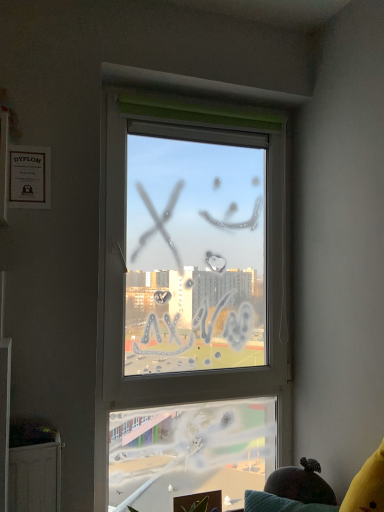
Question: Visually, is velvet yellow couch at lower right positioned to the left or to the right of transparent glass window at center?

Choices:
 (A) left
 (B) right

Answer: (B)

Question: Considering the positions of velvet yellow couch at lower right and transparent glass window at center in the image, is velvet yellow couch at lower right taller or shorter than transparent glass window at center?

Choices:
 (A) short
 (B) tall

Answer: (A)

Question: From a real-world perspective, is velvet yellow couch at lower right above or below transparent glass window at center?

Choices:
 (A) below
 (B) above

Answer: (A)

Question: Based on their positions, is transparent glass window at center located to the left or right of velvet yellow couch at lower right?

Choices:
 (A) left
 (B) right

Answer: (A)

Question: Is transparent glass window at center wider or thinner than velvet yellow couch at lower right?

Choices:
 (A) wide
 (B) thin

Answer: (B)

Question: From a real-world perspective, relative to velvet yellow couch at lower right, is transparent glass window at center vertically above or below?

Choices:
 (A) above
 (B) below

Answer: (A)

Question: Is transparent glass window at center in front of or behind velvet yellow couch at lower right in the image?

Choices:
 (A) front
 (B) behind

Answer: (B)